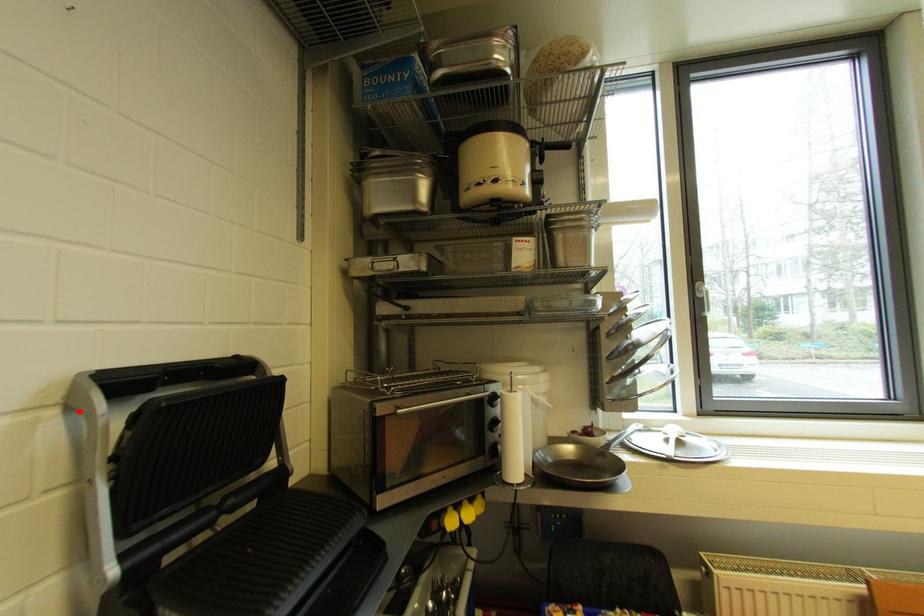
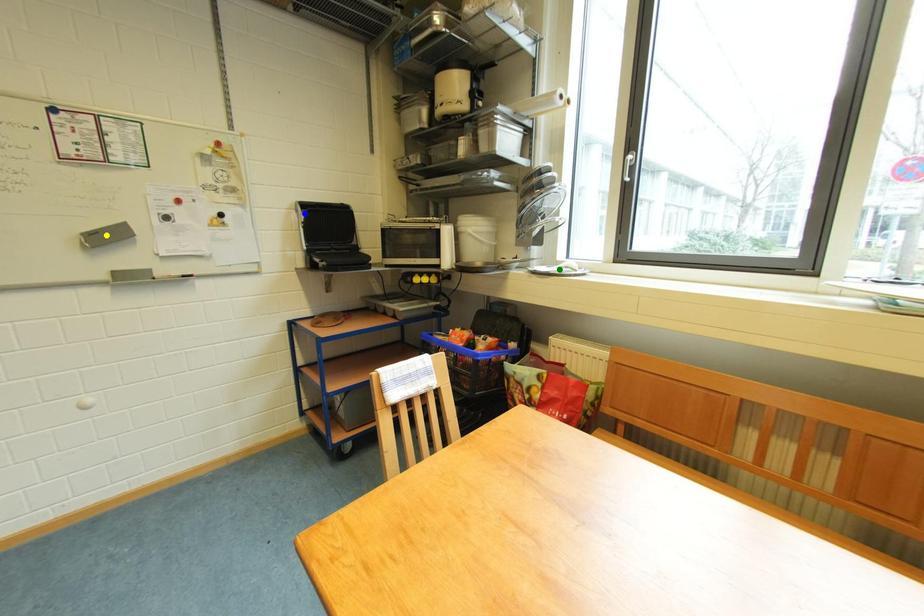
Question: I am providing you with two images of the same scene from different viewpoints. A red point is marked on the first image. You are given multiple points on the second image. Which point in image 2 is actually the same real-world point as the red point in image 1?

Choices:
 (A) blue point
 (B) yellow point
 (C) green point

Answer: (A)